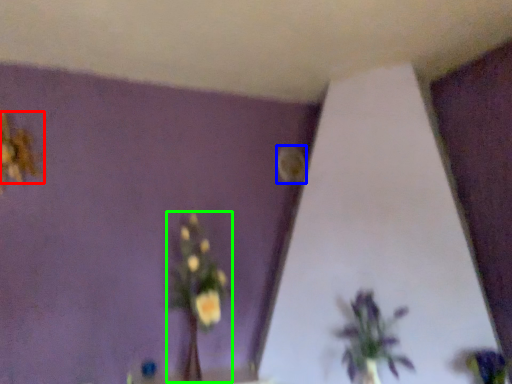
Question: Which is nearer to the flower (highlighted by a red box)? flower (highlighted by a blue box) or floral arrangement (highlighted by a green box).

Choices:
 (A) flower
 (B) floral arrangement

Answer: (B)